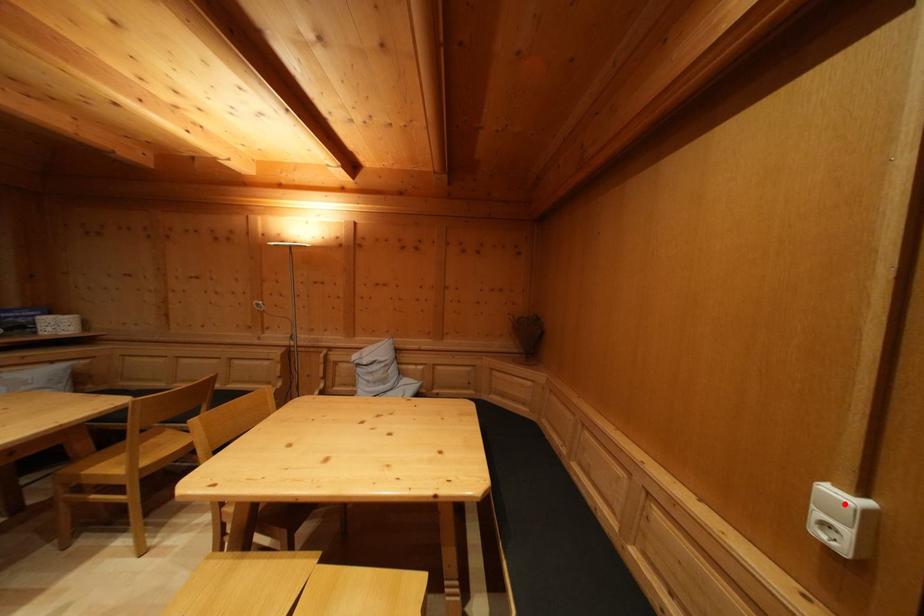
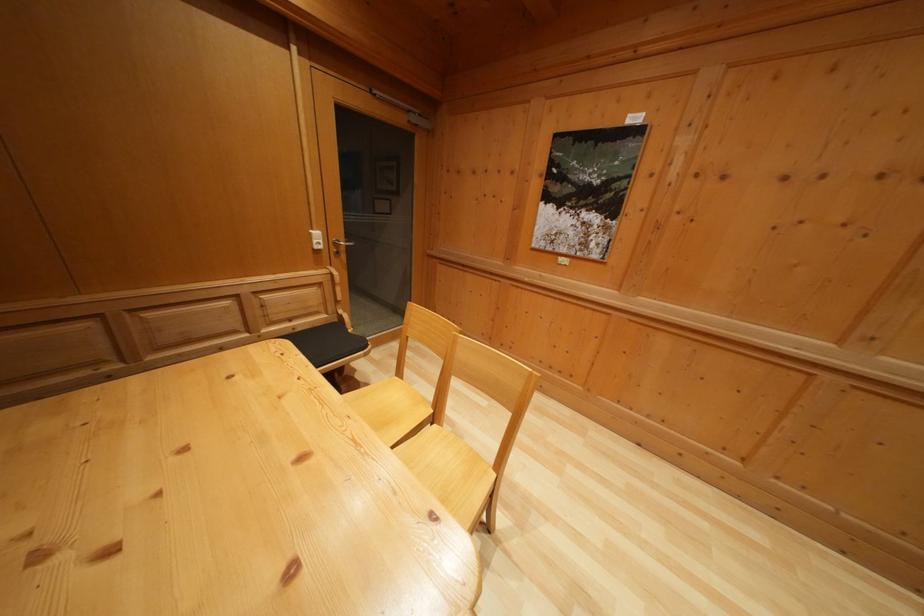
The point at the highlighted location is marked in the first image. Where is the corresponding point in the second image?

(322, 240)